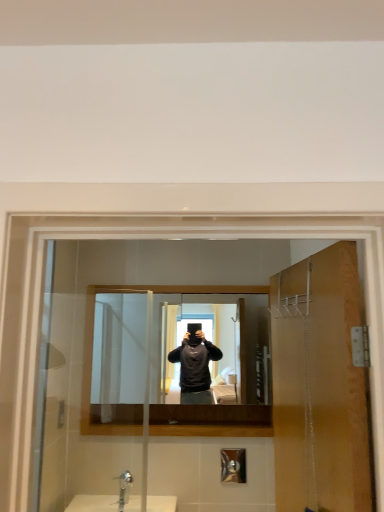
Question: Considering the relative positions of wooden door at right and brushed metal shower at lower center in the image provided, is wooden door at right to the left or to the right of brushed metal shower at lower center?

Choices:
 (A) left
 (B) right

Answer: (B)

Question: Is wooden door at right taller or shorter than brushed metal shower at lower center?

Choices:
 (A) short
 (B) tall

Answer: (B)

Question: Estimate the real-world distances between objects in this image. Which object is closer to the silver metallic faucet at lower center?

Choices:
 (A) wooden door at right
 (B) matte black mirror at center
 (C) brushed metal shower at lower center

Answer: (C)

Question: Estimate the real-world distances between objects in this image. Which object is farther from the silver metallic faucet at lower center?

Choices:
 (A) wooden door at right
 (B) brushed metal shower at lower center
 (C) matte black mirror at center

Answer: (A)